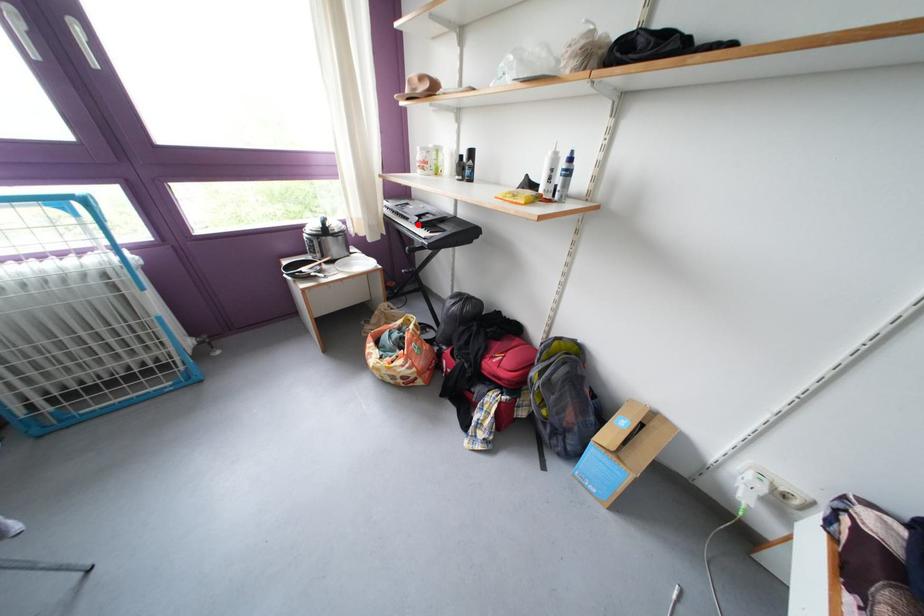
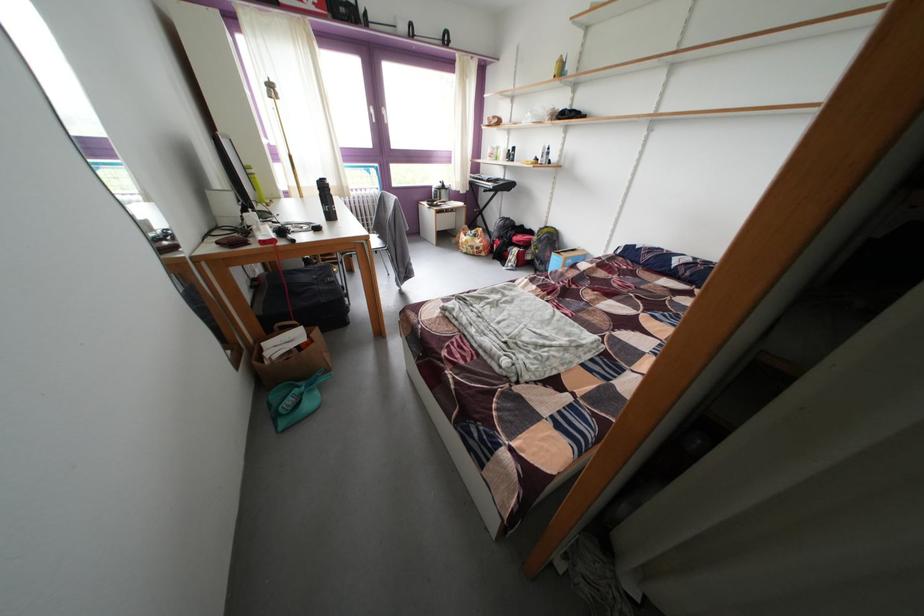
Locate, in the second image, the point that corresponds to the highlighted location in the first image.

(492, 185)